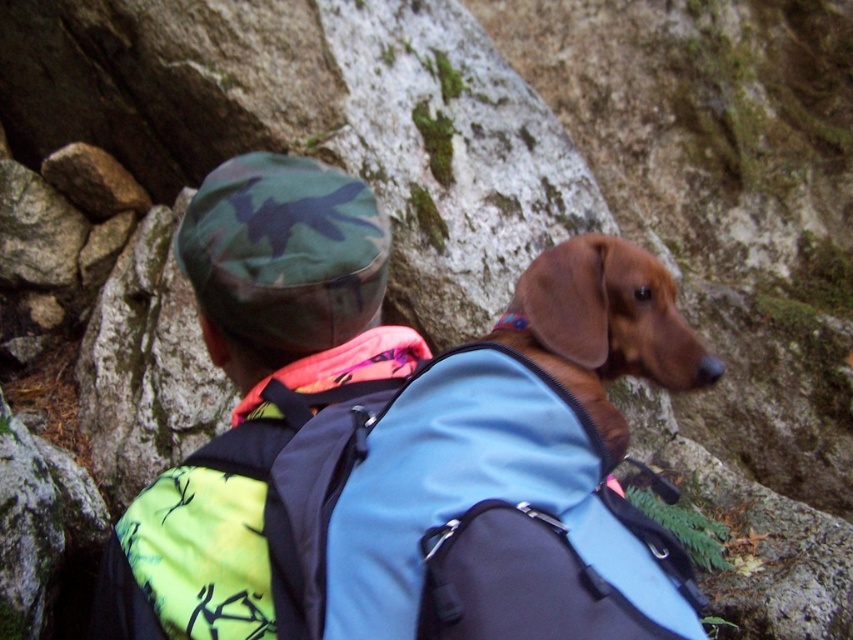
Does camo fabric hat at upper center have a larger size compared to brown smooth dog at center?

Indeed, camo fabric hat at upper center has a larger size compared to brown smooth dog at center.

In the scene shown: Does camo fabric hat at upper center appear on the right side of brown smooth dog at center?

In fact, camo fabric hat at upper center is to the left of brown smooth dog at center.

Is point (289, 166) less distant than point (561, 256)?

No, it is behind (561, 256).

This screenshot has height=640, width=853. I want to click on camo fabric hat at upper center, so click(291, 280).